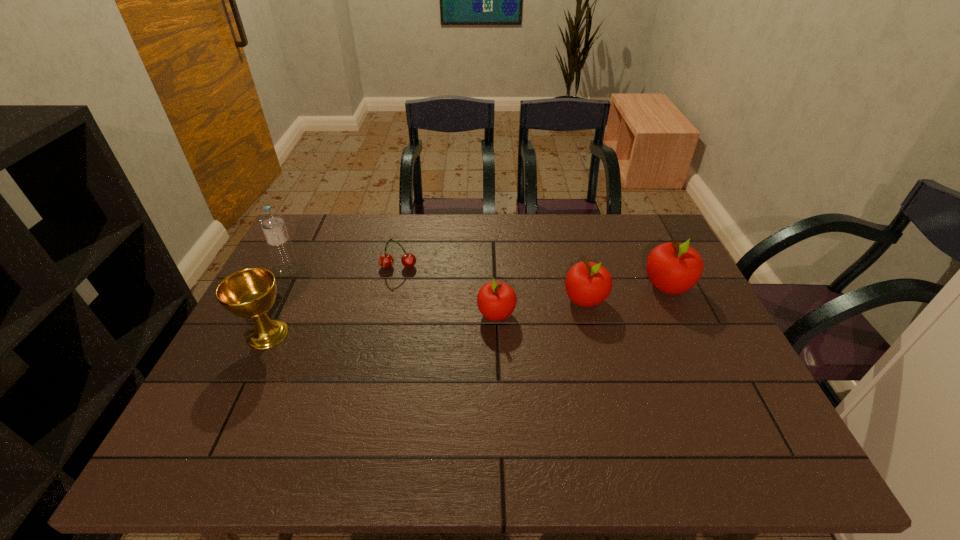
This screenshot has height=540, width=960. What are the coordinates of `the third object from right to left` in the screenshot? It's located at (496, 300).

In order to click on the leftmost apple in this screenshot , I will do `click(496, 300)`.

Locate an element on the screen. This screenshot has width=960, height=540. the second apple from left to right is located at coordinates (587, 284).

Locate an element on the screen. The image size is (960, 540). the second object from right to left is located at coordinates (587, 284).

This screenshot has width=960, height=540. What are the coordinates of `the rightmost apple` in the screenshot? It's located at (673, 268).

Identify the location of the tallest object. This screenshot has height=540, width=960. pyautogui.click(x=272, y=223).

The height and width of the screenshot is (540, 960). I want to click on the fourth object from right to left, so click(x=386, y=260).

You are a GUI agent. You are given a task and a screenshot of the screen. Output one action in this format:
    pyautogui.click(x=<x>, y=<y>)
    Task: Click on the chalice
    This screenshot has height=540, width=960.
    Given the screenshot: What is the action you would take?
    pyautogui.click(x=249, y=293)

Where is `vacant space positioned 0.110m on the right of the leftmost apple`? This screenshot has height=540, width=960. vacant space positioned 0.110m on the right of the leftmost apple is located at coordinates (556, 314).

This screenshot has width=960, height=540. I want to click on vacant point located 0.220m on the right of the second object from right to left, so click(684, 300).